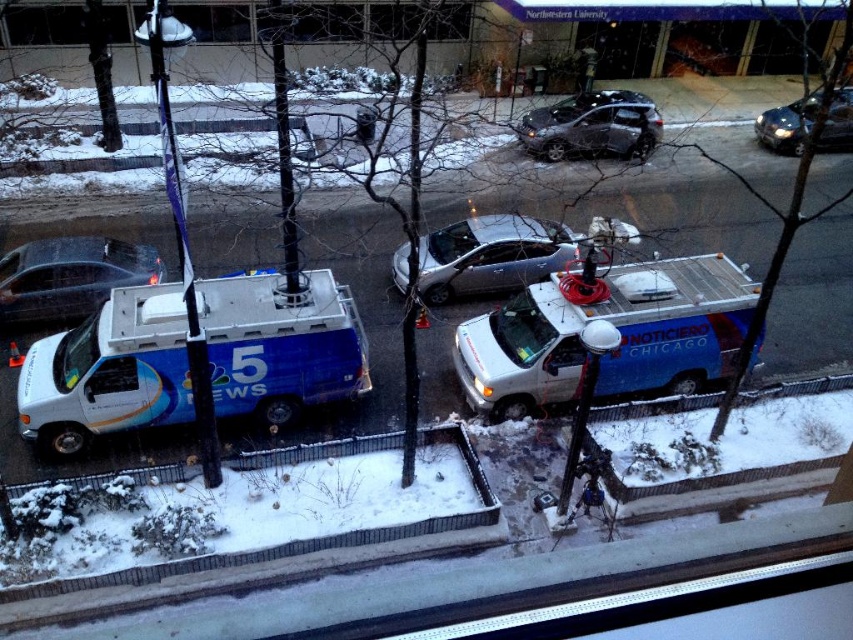
Is blue metallic van at center to the right of transparent glass window at upper center from the viewer's perspective?

Yes, blue metallic van at center is to the right of transparent glass window at upper center.

Is blue metallic van at center in front of transparent glass window at upper center?

That is True.

Find the location of a particular element. blue metallic van at center is located at coordinates (614, 326).

Is silver metallic car at center to the right of shiny black sedan at upper right from the viewer's perspective?

In fact, silver metallic car at center is to the left of shiny black sedan at upper right.

Is silver metallic car at center further to the viewer compared to shiny black sedan at upper right?

That is True.

Image resolution: width=853 pixels, height=640 pixels. I want to click on silver metallic car at center, so click(490, 256).

Describe the element at coordinates (108, 372) in the screenshot. The image size is (853, 640). I see `white glossy van at center` at that location.

Does white glossy van at center appear over silver metallic car at center?

No.

Locate an element on the screen. The height and width of the screenshot is (640, 853). white glossy van at center is located at coordinates (108, 372).